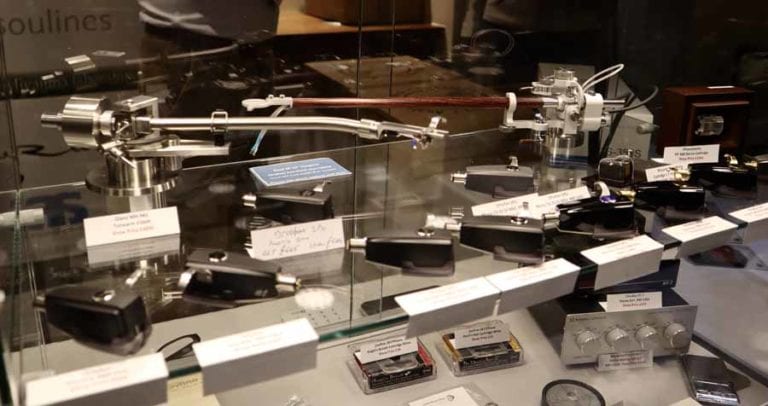
The width and height of the screenshot is (768, 406). I want to click on oulines lettering on wall, so click(45, 18).